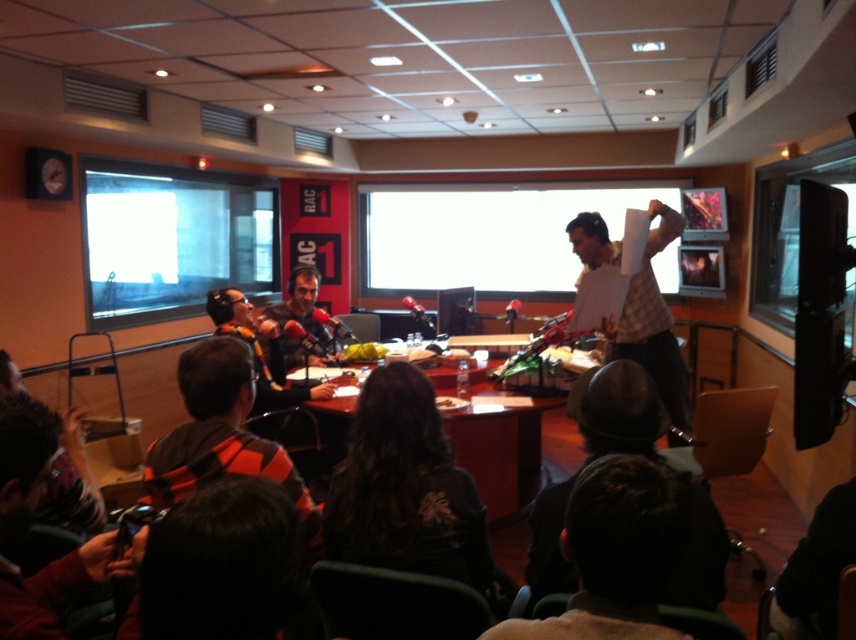
You are a guest on the live show and need to place your personal item, the matte black helmet at lower center, onto the wooden table at center. Can you fit it on the table without any issues?

The matte black helmet at lower center is thinner than the wooden table at center, so it should fit on the table without any issues since its width is less than the table.

You are a technician in the studio who needs to adjust the microphone between the orange and black scarf at lower left and the matte black headphones at center. Is there enough space to move freely between them?

The distance between the orange and black scarf at lower left and the matte black headphones at center is 1.80 meters. This should provide sufficient space for a technician to move freely between them while adjusting the microphone.

You are standing in the radio studio and want to reach the point marked at coordinates (530,564). If your height is 1.7 meters, will you be able to see over the table from that distance?

The distance between you and the point (530,564) is 1.63 meters. Since the table height is not provided, it is impossible to determine if you can see over it.